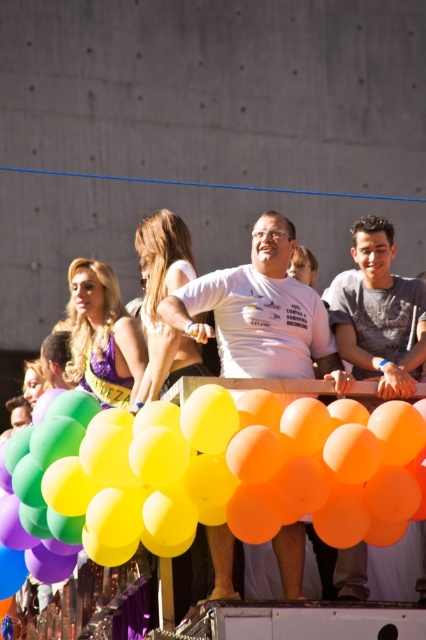
You are a photographer at the parade. You want to take a photo of the matte white shirt at center without the rubber balloons at center blocking it. Is it possible to adjust your position to achieve this?

The rubber balloons at center are in front of the matte white shirt at center, so moving your position might allow you to angle the camera to capture the matte white shirt at center without the balloons blocking it.

You are a photographer at the parade and want to take a photo of the shiny purple dress at center and the matte white shirt at center. Which one will appear closer to the camera in your photo?

The shiny purple dress at center will appear closer to the camera because it is further to the viewer than the matte white shirt at center.

You are a photographer at the parade and want to capture both the white matte shirt at center and the matte white shirt at center in a single shot. Which one should you focus on to ensure both are in frame?

Both the white matte shirt at center and the matte white shirt at center are positioned at the center, but the white matte shirt at center is taller. To ensure both are in frame, focus on the area where they are both centered, adjusting the camera angle to accommodate the height difference.